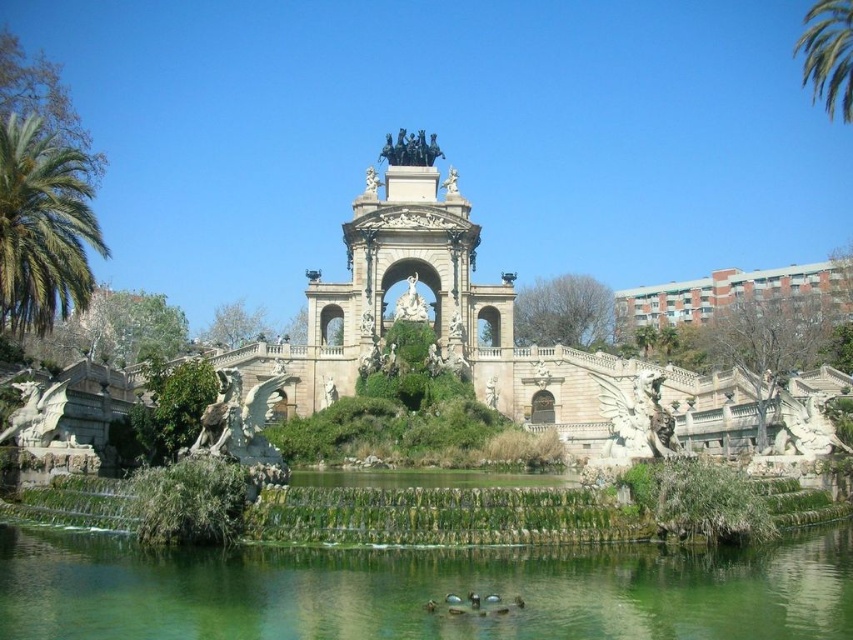
You are standing at the base of the fountain structure and looking towards the archway. There are two points marked on the structure. One is at coordinate point (306, 332) and the other is at point (90, 230). Which point is closer to you?

Point (90, 230) is closer to you because it is in front of point (306, 332).

You are standing in front of the grand fountain structure. There are two points marked on the structure. The first point is at coordinates point (6, 563) and the second is at point (451, 298). Which of these two points is closer to you?

Point (6, 563) is closer to the viewer than point (451, 298).

You are standing in front of the grand structure and want to take a photo that includes both the green leafy palm tree at left and the green leafy palm tree at upper right. Which palm tree should you position closer to the center of your camera frame to ensure both are visible?

You should position the green leafy palm tree at upper right closer to the center of your camera frame because the green leafy palm tree at left is below it, so adjusting the angle to center the upper one will keep both in view.